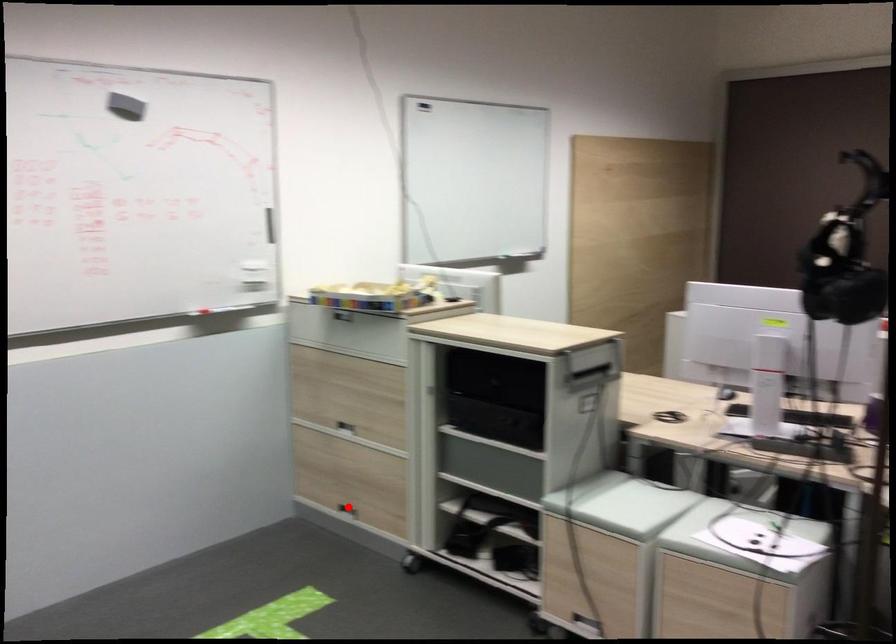
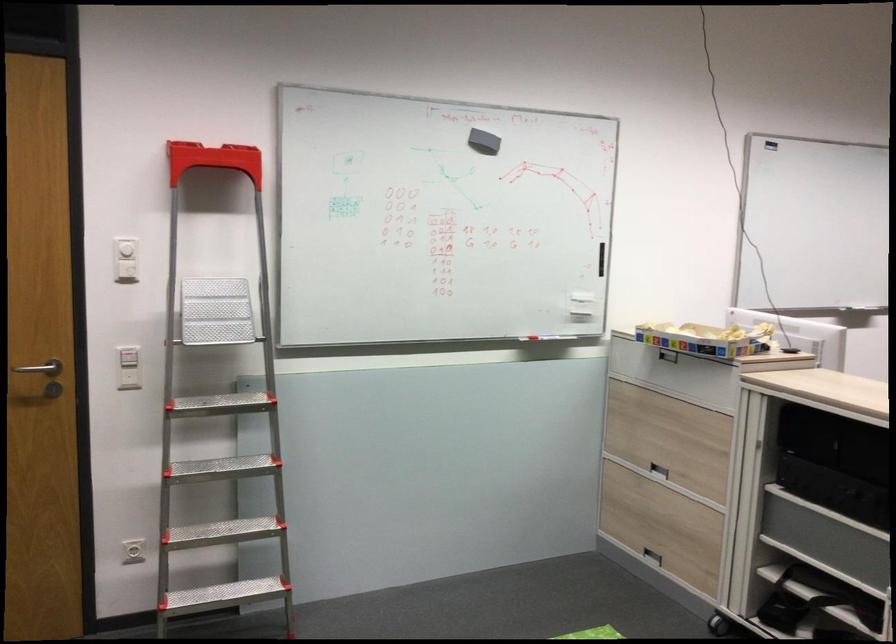
The point at the highlighted location is marked in the first image. Where is the corresponding point in the second image?

(652, 556)